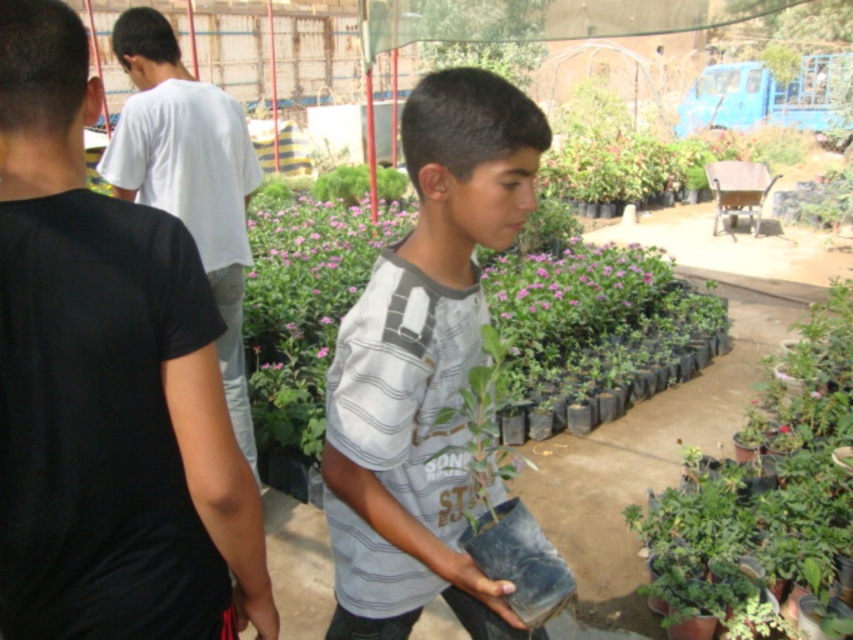
Measure the distance between pink matte flowers at center and pink matte flower at center.

pink matte flowers at center and pink matte flower at center are 6.35 feet apart.

Looking at this image, does pink matte flowers at center appear on the right side of pink matte flower at center?

Indeed, pink matte flowers at center is positioned on the right side of pink matte flower at center.

Is point (531, 307) positioned after point (323, 353)?

Yes, it is behind point (323, 353).

Find the location of a particular element. pink matte flowers at center is located at coordinates (575, 284).

Can you confirm if green matte plant at center-right is thinner than pink matte flowers at center?

No, green matte plant at center-right is not thinner than pink matte flowers at center.

Which is more to the left, green matte plant at center-right or pink matte flowers at center?

pink matte flowers at center

Is point (830, 400) farther from viewer compared to point (500, 284)?

No, (830, 400) is in front of (500, 284).

This screenshot has height=640, width=853. Find the location of `green matte plant at center-right`. green matte plant at center-right is located at coordinates (767, 492).

Which is above, gray striped shirt at center or pink matte flowers at center?

Positioned higher is pink matte flowers at center.

In the scene shown: Between gray striped shirt at center and pink matte flowers at center, which one appears on the left side from the viewer's perspective?

Positioned to the left is gray striped shirt at center.

Who is more distant from viewer, (x=459, y=93) or (x=618, y=257)?

Point (x=618, y=257)

At what (x,y) coordinates should I click in order to perform the action: click on gray striped shirt at center. Please return your answer as a coordinate pair (x, y). The image size is (853, 640). Looking at the image, I should click on (424, 368).